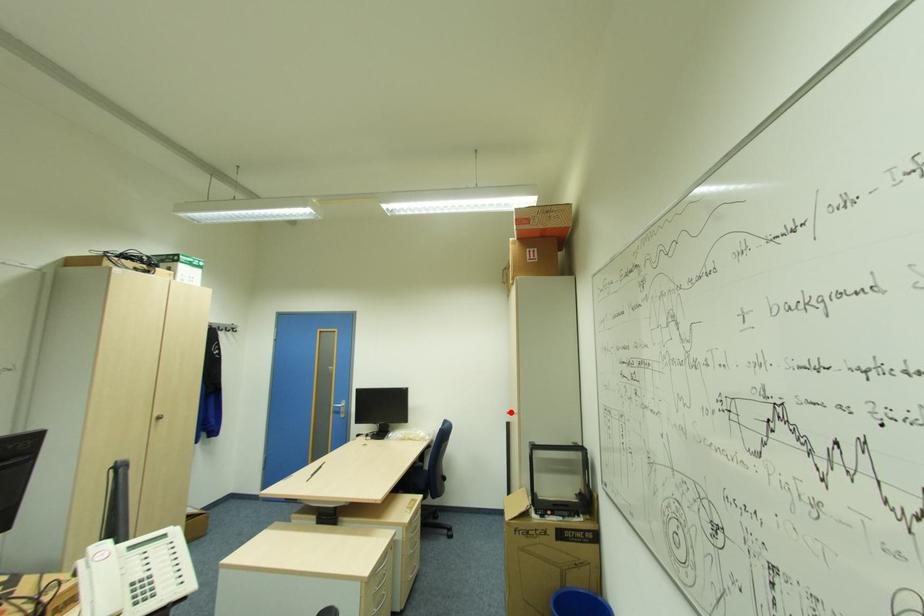
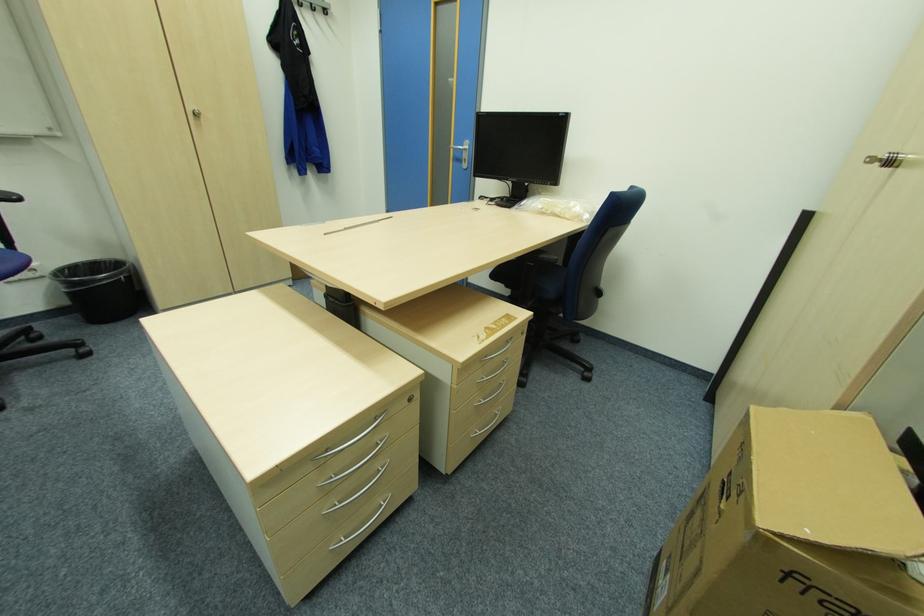
Find the pixel in the second image that matches the highlighted location in the first image.

(873, 159)